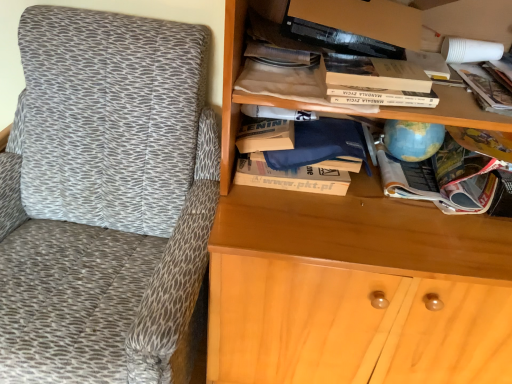
Question: From the image's perspective, is multicolored paper magazine at center right, which appears as the 1th book when viewed from the right, above or below textured fabric chair at left?

Choices:
 (A) below
 (B) above

Answer: (B)

Question: From a real-world perspective, is multicolored paper magazine at center right, which appears as the 1th book when viewed from the right, above or below textured fabric chair at left?

Choices:
 (A) below
 (B) above

Answer: (B)

Question: Which is farther from the white cardboard book at center, which appears as the second book when viewed from the left?

Choices:
 (A) textured fabric chair at left
 (B) wooden bookshelf at upper right
 (C) white paper bag at upper center, which appears as the 3th book when viewed from the right
 (D) multicolored paper magazine at center right, which is counted as the third book, starting from the left
 (E) hardcover book at upper center

Answer: (A)

Question: Considering the real-world distances, which object is farthest from the white paper bag at upper center, the first book when ordered from left to right?

Choices:
 (A) wooden bookshelf at upper right
 (B) multicolored paper magazine at center right, which is counted as the third book, starting from the left
 (C) textured fabric chair at left
 (D) hardcover book at upper center
 (E) white cardboard book at center, which appears as the second book when viewed from the left

Answer: (C)